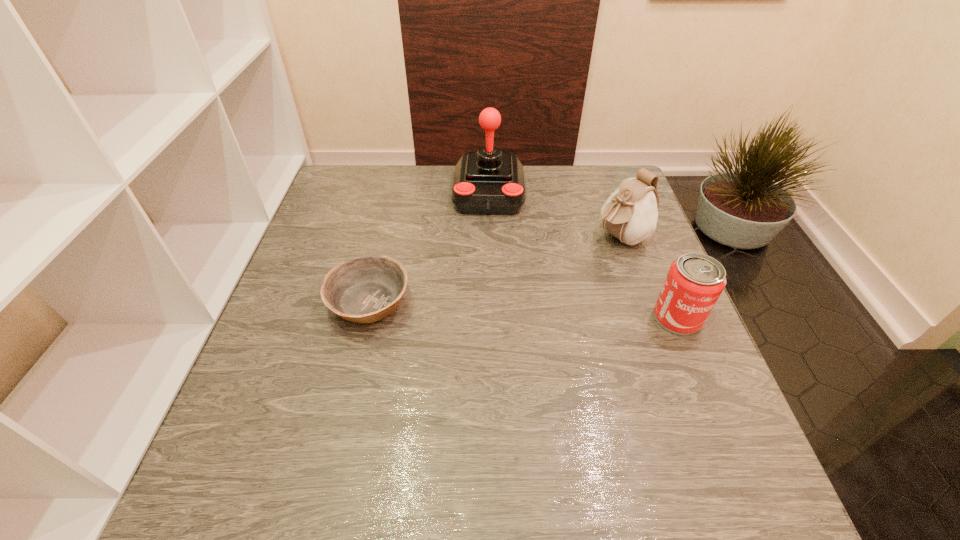
Locate an element on the screen. The image size is (960, 540). empty space between the bowl and the joystick is located at coordinates (429, 248).

The height and width of the screenshot is (540, 960). In order to click on free spot between the shortest object and the second shortest object in this screenshot , I will do `click(523, 310)`.

Where is `free spot between the shortest object and the pouch`? free spot between the shortest object and the pouch is located at coordinates (494, 270).

Locate an element on the screen. This screenshot has height=540, width=960. object that can be found as the second closest to the second shortest object is located at coordinates 486,182.

Where is `object that is the third closest to the leftmost object`? This screenshot has width=960, height=540. object that is the third closest to the leftmost object is located at coordinates tap(695, 281).

Where is `free space that satisfies the following two spatial constraints: 1. on the back side of the third shortest object; 2. on the right side of the leftmost object`? The width and height of the screenshot is (960, 540). free space that satisfies the following two spatial constraints: 1. on the back side of the third shortest object; 2. on the right side of the leftmost object is located at coordinates (385, 237).

The image size is (960, 540). In order to click on free location that satisfies the following two spatial constraints: 1. on the front side of the tallest object; 2. on the right side of the third tallest object in this screenshot , I will do `click(492, 318)`.

I want to click on free spot that satisfies the following two spatial constraints: 1. on the front side of the second shortest object; 2. on the right side of the tallest object, so click(x=492, y=318).